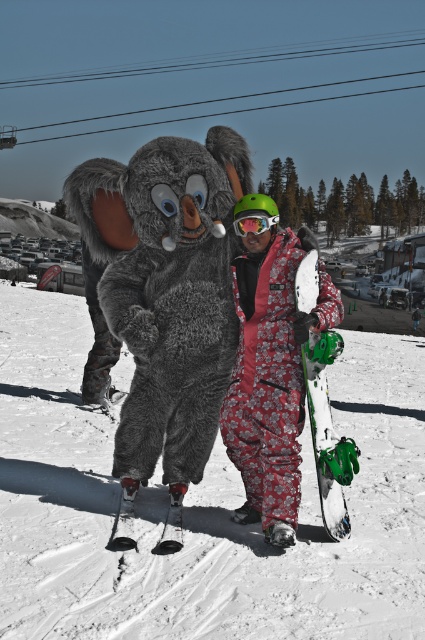
Does fuzzy gray costume at center appear on the right side of white matte snowboard at center?

In fact, fuzzy gray costume at center is to the left of white matte snowboard at center.

Can you confirm if fuzzy gray costume at center is thinner than white matte snowboard at center?

No, fuzzy gray costume at center is not thinner than white matte snowboard at center.

The height and width of the screenshot is (640, 425). I want to click on fuzzy gray costume at center, so click(175, 301).

Which is below, white snowboard at center or green matte goggles at center?

white snowboard at center is lower down.

Which is in front, point (380, 545) or point (235, 227)?

Positioned in front is point (380, 545).

What do you see at coordinates (200, 508) in the screenshot?
I see `white snowboard at center` at bounding box center [200, 508].

Where is `white snowboard at center`? This screenshot has width=425, height=640. white snowboard at center is located at coordinates (200, 508).

Locate an element on the screen. fuzzy gray costume at center is located at coordinates [175, 301].

Does fuzzy gray costume at center have a smaller size compared to black matte ski at lower center?

No.

Is point (189, 227) farther from camera compared to point (167, 509)?

No, it is in front of (167, 509).

I want to click on fuzzy gray costume at center, so click(175, 301).